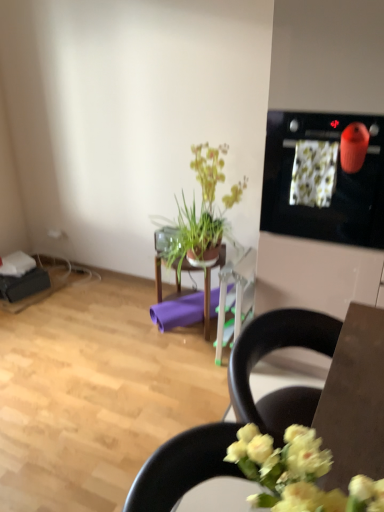
Question: Is black glossy oven at upper right shorter than wooden table at center?

Choices:
 (A) no
 (B) yes

Answer: (A)

Question: Is black glossy oven at upper right thinner than wooden table at center?

Choices:
 (A) yes
 (B) no

Answer: (B)

Question: Can you see black glossy oven at upper right touching wooden table at center?

Choices:
 (A) yes
 (B) no

Answer: (B)

Question: Does black glossy oven at upper right appear on the right side of wooden table at center?

Choices:
 (A) no
 (B) yes

Answer: (B)

Question: Does black glossy oven at upper right have a greater width compared to wooden table at center?

Choices:
 (A) yes
 (B) no

Answer: (A)

Question: Does black glossy oven at upper right lie behind wooden table at center?

Choices:
 (A) no
 (B) yes

Answer: (A)

Question: Considering the relative positions of black plastic chair at lower right and green leafy plant at center in the image provided, is black plastic chair at lower right to the right of green leafy plant at center from the viewer's perspective?

Choices:
 (A) yes
 (B) no

Answer: (B)

Question: From the image's perspective, is black plastic chair at lower right located above green leafy plant at center?

Choices:
 (A) no
 (B) yes

Answer: (A)

Question: Is black plastic chair at lower right to the left of green leafy plant at center from the viewer's perspective?

Choices:
 (A) no
 (B) yes

Answer: (B)

Question: Is black plastic chair at lower right smaller than green leafy plant at center?

Choices:
 (A) yes
 (B) no

Answer: (B)

Question: From a real-world perspective, does black plastic chair at lower right sit lower than green leafy plant at center?

Choices:
 (A) yes
 (B) no

Answer: (A)

Question: Does black plastic chair at lower right have a larger size compared to green leafy plant at center?

Choices:
 (A) yes
 (B) no

Answer: (A)

Question: Can you confirm if wooden table at center is shorter than purple matte yoga mat at center?

Choices:
 (A) yes
 (B) no

Answer: (B)